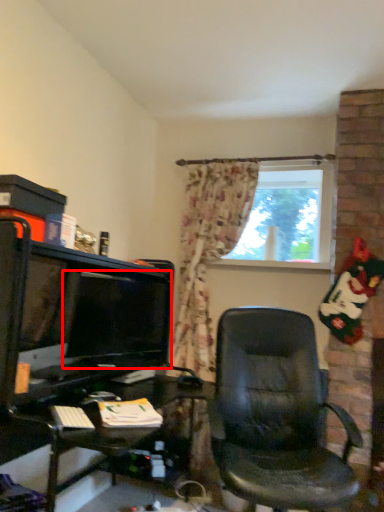
Question: From the image's perspective, what is the correct spatial relationship of computer monitor (annotated by the red box) in relation to window?

Choices:
 (A) above
 (B) below

Answer: (B)